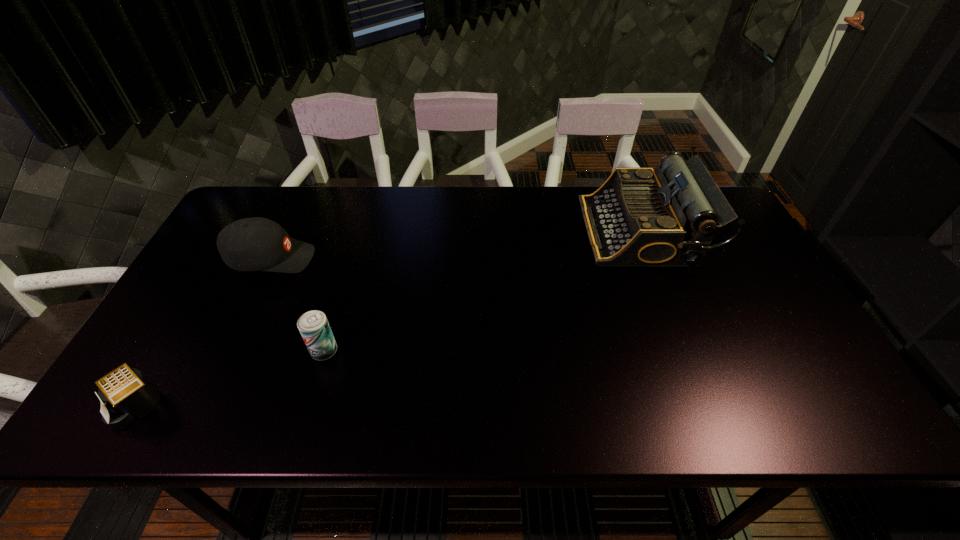
Image resolution: width=960 pixels, height=540 pixels. In order to click on vacant area that satisfies the following two spatial constraints: 1. with a logo on the front of the baseball cap; 2. on the left side of the second object from right to left in this screenshot , I will do `click(228, 351)`.

The width and height of the screenshot is (960, 540). I want to click on free spot that satisfies the following two spatial constraints: 1. on the back side of the third object from left to right; 2. with a logo on the front of the baseball cap, so click(351, 259).

I want to click on vacant space that satisfies the following two spatial constraints: 1. on the keyboard of the typewriter; 2. on the front side of the nearest object, so click(709, 405).